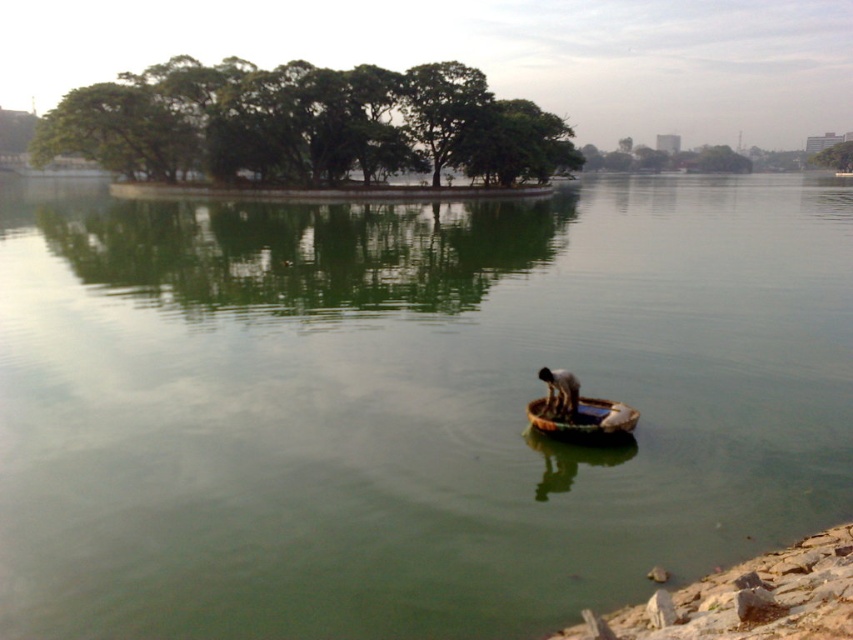
Question: Is green smooth water at center closer to the viewer compared to brown woven canoe at center?

Choices:
 (A) yes
 (B) no

Answer: (A)

Question: Observing the image, what is the correct spatial positioning of green smooth water at center in reference to brown woven canoe at center?

Choices:
 (A) above
 (B) below

Answer: (A)

Question: Which is farther from the brown woven basket at center?

Choices:
 (A) green smooth water at center
 (B) brown woven canoe at center

Answer: (A)

Question: Considering the real-world distances, which object is farthest from the green smooth water at center?

Choices:
 (A) brown woven basket at center
 (B) brown woven canoe at center

Answer: (A)

Question: Does brown woven canoe at center appear under brown woven basket at center?

Choices:
 (A) yes
 (B) no

Answer: (A)

Question: Which point is farther to the camera?

Choices:
 (A) (604, 412)
 (B) (573, 410)

Answer: (A)